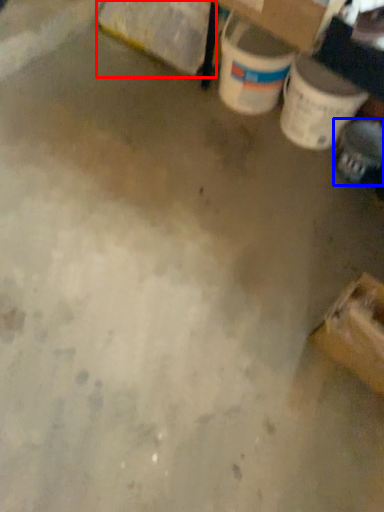
Question: Which object appears farthest to the camera in this image, cardboard box (highlighted by a red box) or footwear (highlighted by a blue box)?

Choices:
 (A) cardboard box
 (B) footwear

Answer: (A)